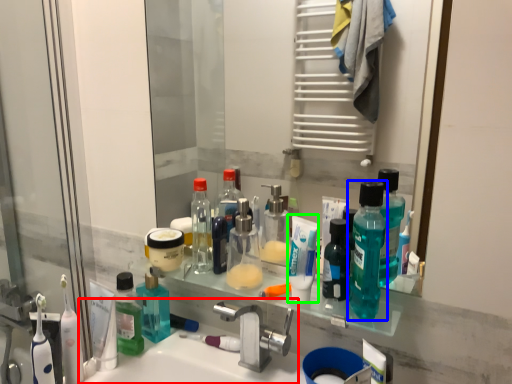
Question: Considering the real-world distances, which object is closest to sink (highlighted by a red box)? bottle (highlighted by a blue box) or toothpaste (highlighted by a green box).

Choices:
 (A) bottle
 (B) toothpaste

Answer: (B)